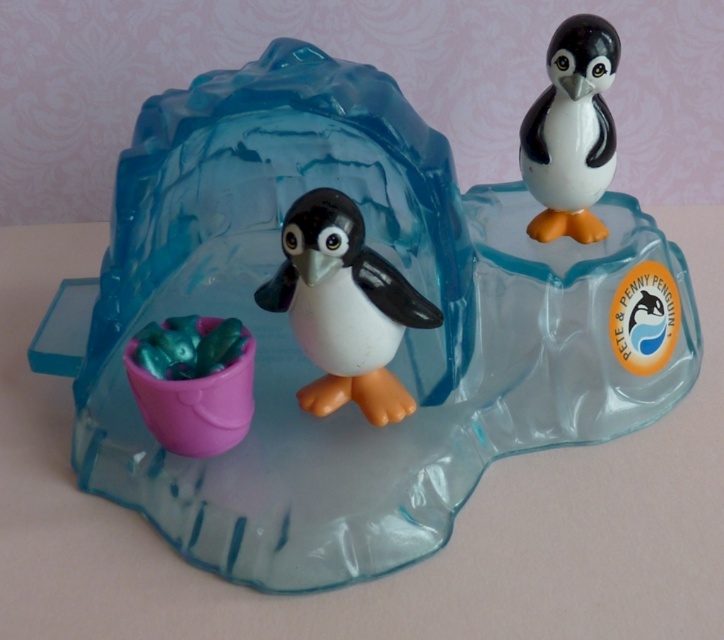
Question: In this image, where is white glossy penguin at center located relative to smooth glossy penguin at upper right?

Choices:
 (A) right
 (B) left

Answer: (B)

Question: Which of the following is the farthest from the observer?

Choices:
 (A) white glossy penguin at center
 (B) smooth glossy penguin at upper right

Answer: (B)

Question: Does white glossy penguin at center have a lesser width compared to smooth glossy penguin at upper right?

Choices:
 (A) yes
 (B) no

Answer: (B)

Question: Is white glossy penguin at center positioned in front of smooth glossy penguin at upper right?

Choices:
 (A) yes
 (B) no

Answer: (A)

Question: Which object appears farthest from the camera in this image?

Choices:
 (A) smooth glossy penguin at upper right
 (B) white glossy penguin at center

Answer: (A)